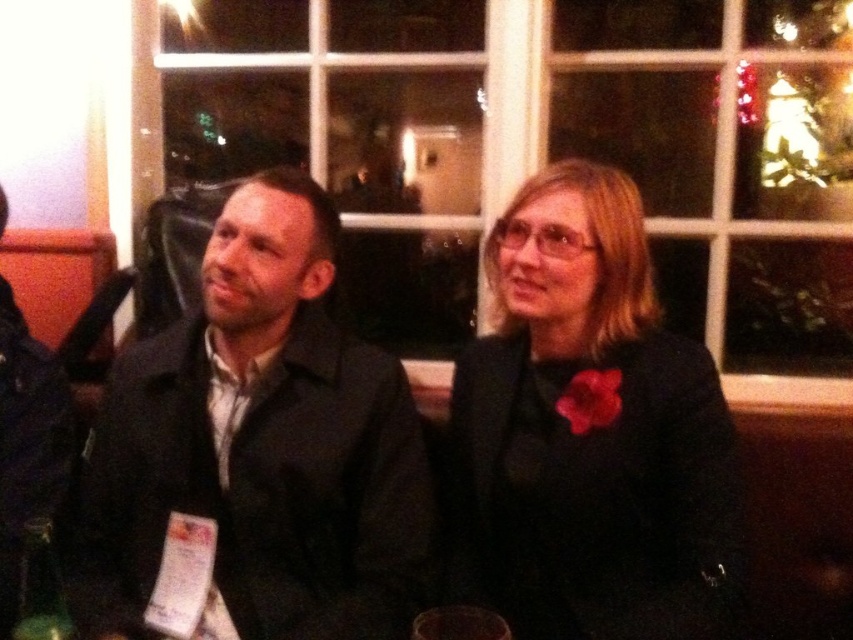
Question: Which point appears farthest from the camera in this image?

Choices:
 (A) (612, 544)
 (B) (305, 317)

Answer: (B)

Question: Can you confirm if matte black jacket at left is positioned to the right of matte black jacket at center?

Choices:
 (A) yes
 (B) no

Answer: (B)

Question: Is matte black jacket at left closer to the viewer compared to matte black jacket at center?

Choices:
 (A) yes
 (B) no

Answer: (B)

Question: Can you confirm if matte black jacket at left is positioned above matte black jacket at center?

Choices:
 (A) no
 (B) yes

Answer: (B)

Question: Which of the following is the closest to the observer?

Choices:
 (A) (173, 342)
 (B) (726, 410)

Answer: (B)